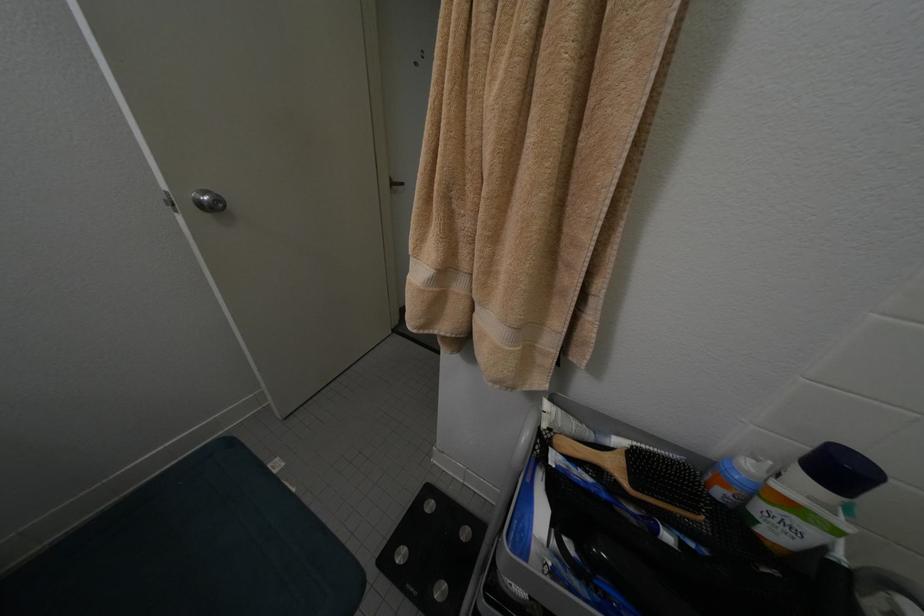
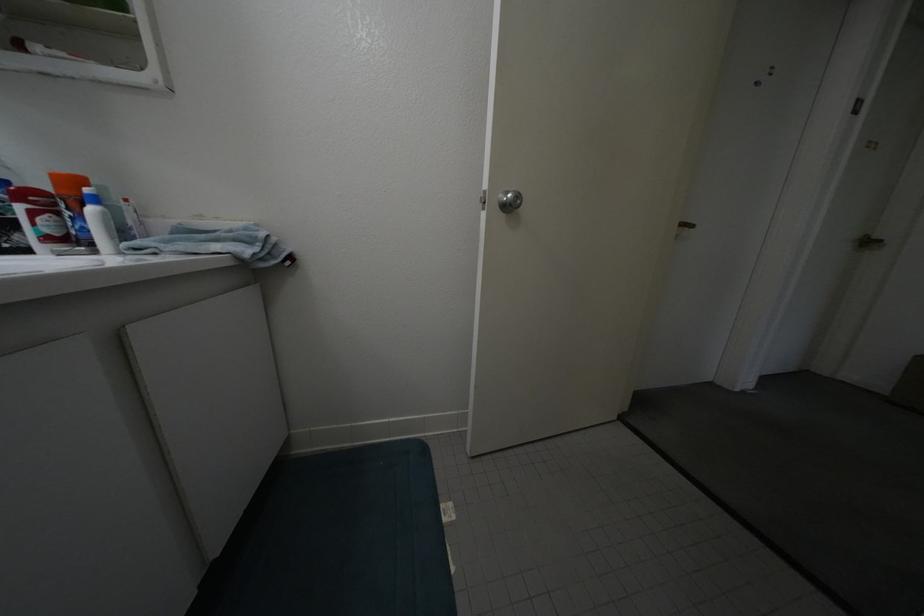
Question: The images are taken continuously from a first-person perspective. In which direction is your viewpoint rotating?

Choices:
 (A) Left
 (B) Right
 (C) Up
 (D) Down

Answer: (A)